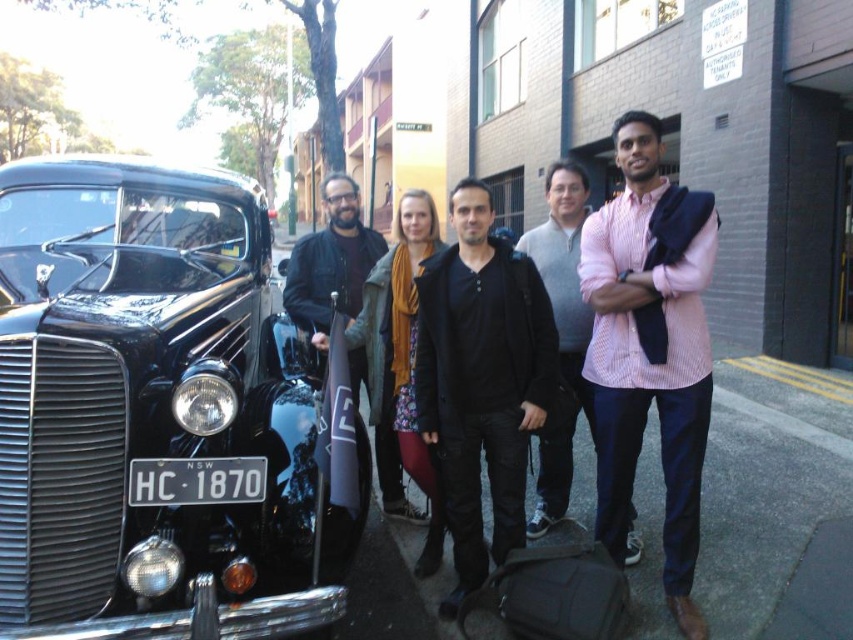
Is shiny black car at left to the left of pink textured shirt at center from the viewer's perspective?

Correct, you'll find shiny black car at left to the left of pink textured shirt at center.

Does point (302, 630) come behind point (554, 182)?

That is False.

Which is behind, point (165, 372) or point (589, 394)?

The point (589, 394) is more distant.

The height and width of the screenshot is (640, 853). In order to click on shiny black car at left in this screenshot , I will do [x=154, y=410].

What do you see at coordinates (561, 332) in the screenshot?
I see `pink textured shirt at center` at bounding box center [561, 332].

Who is positioned more to the left, pink textured shirt at center or black metal license plate at lower left?

From the viewer's perspective, black metal license plate at lower left appears more on the left side.

Which is in front, point (554, 285) or point (209, 497)?

Positioned in front is point (209, 497).

Identify the location of pink textured shirt at center. (561, 332).

Between matte black jacket at center and dark brown leather jacket at center, which one appears on the left side from the viewer's perspective?

dark brown leather jacket at center

Looking at this image, between matte black jacket at center and dark brown leather jacket at center, which one appears on the right side from the viewer's perspective?

From the viewer's perspective, matte black jacket at center appears more on the right side.

I want to click on matte black jacket at center, so click(x=648, y=349).

I want to click on matte black jacket at center, so click(x=648, y=349).